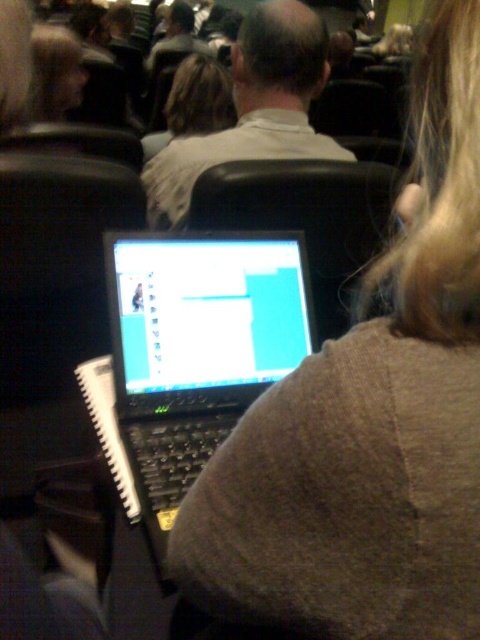
You are standing at the back of the room and want to see the screen of the matte black laptop at center. The average human eye can focus on objects as close as 10 inches. Can you see the screen clearly from where you are?

The matte black laptop at center is 33.01 inches away from the camera, which is beyond the average human eye focus distance of 10 inches. Therefore, you can see the screen clearly from that distance.

You are organizing a workshop and need to ensure that all participants have enough space to work. The matte black laptop at center and the blonde hair at upper left are both on the same table. Which object takes up more space?

The blonde hair at upper left takes up more space than the matte black laptop at center because the description states that the matte black laptop at center has a smaller size compared to blonde hair at upper left.

You are a photographer at the event. You want to take a photo of the person with blonde hair at upper left without the matte black laptop at center blocking the view. Is the distance between them sufficient to ensure the laptop won

The matte black laptop at center is 1.28 meters away from the blonde hair at upper left. Since the distance is relatively large, the photographer can position themselves in a way that avoids the laptop obstructing the view of the blonde hair at upper left.